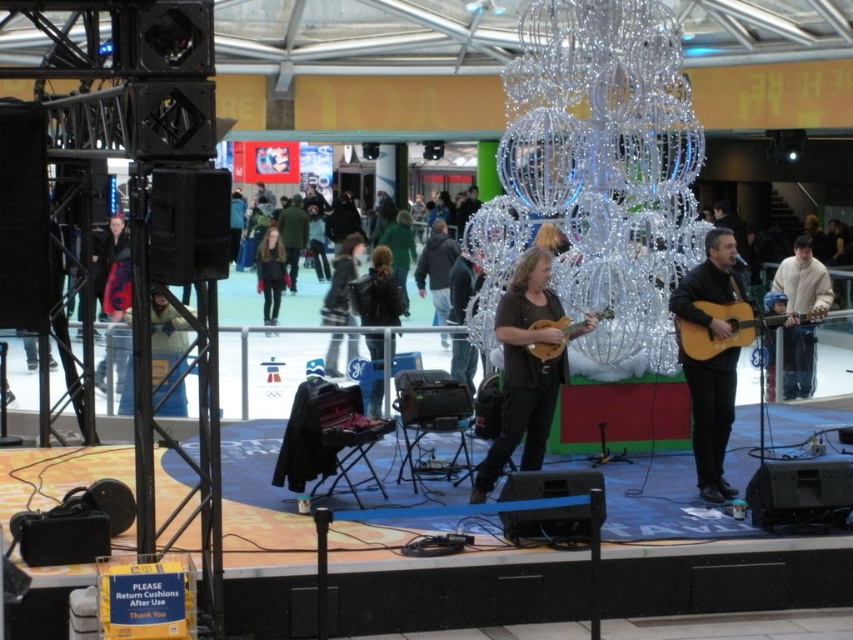
Is white woolen sweater at right thinner than wooden acoustic guitar at center?

Correct, white woolen sweater at right's width is less than wooden acoustic guitar at center's.

Is point (810, 273) more distant than point (608, 307)?

Yes, it is.

Image resolution: width=853 pixels, height=640 pixels. I want to click on white woolen sweater at right, so [804, 280].

Between brown matte mandolin at center and white woolen sweater at right, which one appears on the right side from the viewer's perspective?

From the viewer's perspective, white woolen sweater at right appears more on the right side.

Is point (506, 369) more distant than point (810, 342)?

No.

Describe the element at coordinates (524, 369) in the screenshot. I see `brown matte mandolin at center` at that location.

Where is `brown matte mandolin at center`? Image resolution: width=853 pixels, height=640 pixels. brown matte mandolin at center is located at coordinates (524, 369).

Between white woolen sweater at right and black leather jacket at center, which one has more height?

With more height is black leather jacket at center.

Between white woolen sweater at right and black leather jacket at center, which one is positioned higher?

Positioned higher is black leather jacket at center.

Does point (795, 257) come behind point (381, 387)?

Yes, point (795, 257) is behind point (381, 387).

What are the coordinates of `white woolen sweater at right` in the screenshot? It's located at (804, 280).